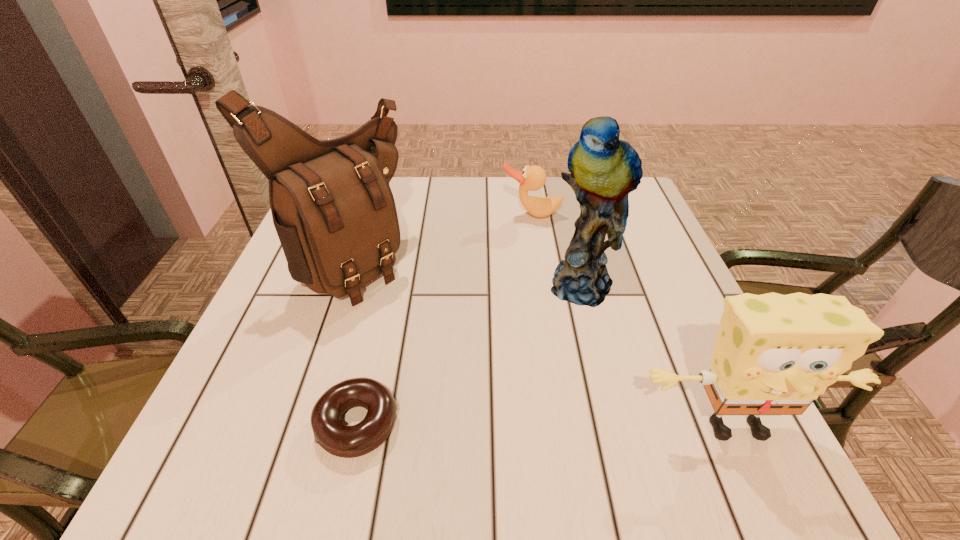
You are a GUI agent. You are given a task and a screenshot of the screen. Output one action in this format:
    pyautogui.click(x=<x>, y=<y>)
    Task: Click on the shortest object
    Image resolution: width=960 pixels, height=540 pixels.
    Given the screenshot: What is the action you would take?
    pyautogui.click(x=330, y=433)

Identify the location of sponge. (775, 354).

This screenshot has height=540, width=960. Identify the location of shoulder bag. (334, 212).

Locate an element on the screen. duck is located at coordinates 533,178.

Locate an element on the screen. This screenshot has width=960, height=540. parrot is located at coordinates (604, 170).

At what (x,y) coordinates should I click in order to perform the action: click on vacant space located 0.230m on the back of the shortest object. Please return your answer as a coordinate pair (x, y). The image size is (960, 540). Looking at the image, I should click on (386, 296).

This screenshot has width=960, height=540. In order to click on free space located on the front-facing side of the shoulder bag in this screenshot , I will do `click(475, 354)`.

You are a GUI agent. You are given a task and a screenshot of the screen. Output one action in this format:
    pyautogui.click(x=<x>, y=<y>)
    Task: Click on the vacant space situated 0.240m on the front-facing side of the shoulder bag
    This screenshot has height=540, width=960.
    Given the screenshot: What is the action you would take?
    pyautogui.click(x=470, y=352)

I want to click on free space located on the front-facing side of the shoulder bag, so click(463, 346).

At what (x,y) coordinates should I click in order to perform the action: click on free space located on the beak of the second shortest object. Please return your answer as a coordinate pair (x, y). The width and height of the screenshot is (960, 540). Looking at the image, I should click on (527, 262).